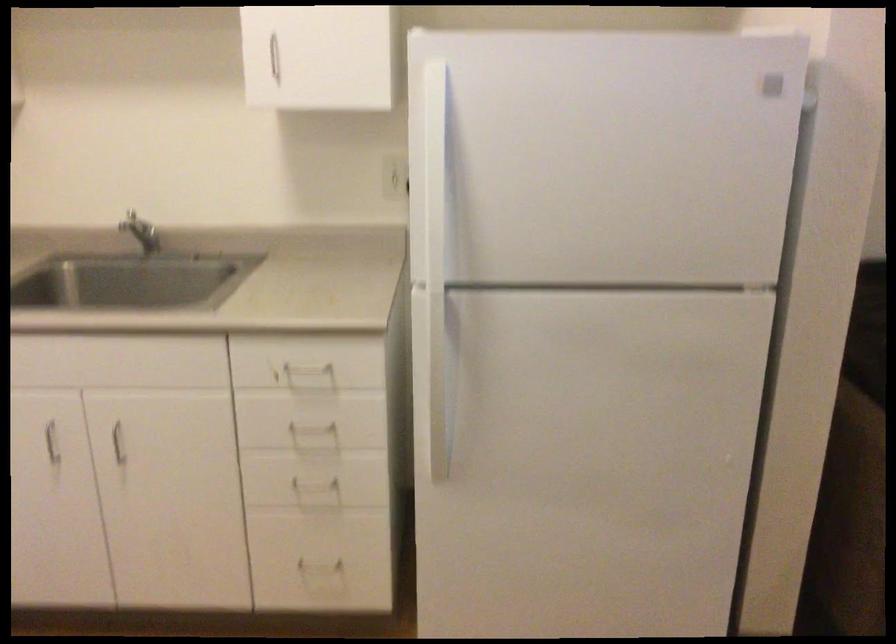
What are the coordinates of `faucet handle` in the screenshot? It's located at (136, 228).